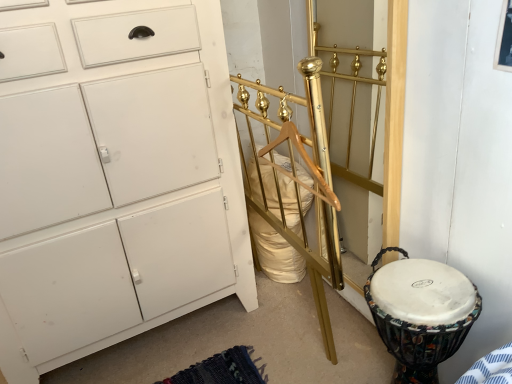
The image size is (512, 384). What are the coordinates of `white fabric-covered drum at lower right` in the screenshot? It's located at (421, 313).

What do you see at coordinates (298, 181) in the screenshot?
I see `gold polished metal bed frame at center` at bounding box center [298, 181].

Where is `white fabric-covered drum at lower right`? The width and height of the screenshot is (512, 384). white fabric-covered drum at lower right is located at coordinates (421, 313).

From their relative heights in the image, would you say white fabric-covered drum at lower right is taller or shorter than white matte cabinet at left?

white fabric-covered drum at lower right is shorter than white matte cabinet at left.

From a real-world perspective, is white fabric-covered drum at lower right under white matte cabinet at left?

Yes, from a real-world perspective, white fabric-covered drum at lower right is beneath white matte cabinet at left.

Which of these two, white matte cabinet at left or gold polished metal bed frame at center, stands taller?

Standing taller between the two is white matte cabinet at left.

Considering the points (229, 169) and (279, 178), which point is in front, point (229, 169) or point (279, 178)?

Positioned in front is point (229, 169).

How distant is white matte cabinet at left from gold polished metal bed frame at center?

A distance of 39.98 centimeters exists between white matte cabinet at left and gold polished metal bed frame at center.

From the image's perspective, between gold polished metal bed frame at center and white matte cabinet at left, who is located below?

gold polished metal bed frame at center appears lower in the image.

This screenshot has width=512, height=384. I want to click on bed frame to the right of white matte cabinet at left, so click(x=298, y=181).

Is the surface of gold polished metal bed frame at center in direct contact with white matte cabinet at left?

There is a gap between gold polished metal bed frame at center and white matte cabinet at left.

Can you confirm if white matte cabinet at left is wider than white fabric-covered drum at lower right?

Yes, white matte cabinet at left is wider than white fabric-covered drum at lower right.

Is white matte cabinet at left facing towards white fabric-covered drum at lower right?

Yes, white matte cabinet at left is facing white fabric-covered drum at lower right.

Which object is positioned more to the left, white matte cabinet at left or white fabric-covered drum at lower right?

Positioned to the left is white matte cabinet at left.

Which is behind, point (206, 74) or point (447, 355)?

Point (206, 74)

Looking at this image, how distant is gold polished metal bed frame at center from white fabric-covered drum at lower right?

They are 12.82 inches apart.

Which object is positioned more to the right, gold polished metal bed frame at center or white fabric-covered drum at lower right?

From the viewer's perspective, white fabric-covered drum at lower right appears more on the right side.

Are gold polished metal bed frame at center and white fabric-covered drum at lower right far apart?

No.

How many degrees apart are the facing directions of gold polished metal bed frame at center and white fabric-covered drum at lower right?

They differ by 0.828 degrees in their facing directions.

Is white fabric-covered drum at lower right thinner than gold polished metal bed frame at center?

In fact, white fabric-covered drum at lower right might be wider than gold polished metal bed frame at center.

From the image's perspective, which is below, white fabric-covered drum at lower right or gold polished metal bed frame at center?

From the image's view, white fabric-covered drum at lower right is below.

From the picture: Considering the positions of objects white fabric-covered drum at lower right and gold polished metal bed frame at center in the image provided, who is more to the left, white fabric-covered drum at lower right or gold polished metal bed frame at center?

gold polished metal bed frame at center.

The height and width of the screenshot is (384, 512). Find the location of `the chest of drawers positioned vertically above the white fabric-covered drum at lower right (from a real-world perspective)`. the chest of drawers positioned vertically above the white fabric-covered drum at lower right (from a real-world perspective) is located at coordinates (113, 176).

The height and width of the screenshot is (384, 512). Identify the location of bed frame directly beneath the white matte cabinet at left (from a real-world perspective). pos(298,181).

Looking at the image, which one is located closer to white matte cabinet at left, gold polished metal bed frame at center or white fabric-covered drum at lower right?

The object closer to white matte cabinet at left is gold polished metal bed frame at center.

From the image, which object appears to be farther from gold polished metal bed frame at center, white fabric-covered drum at lower right or white matte cabinet at left?

Among the two, white matte cabinet at left is located further to gold polished metal bed frame at center.

From the image, which object appears to be farther from white matte cabinet at left, white fabric-covered drum at lower right or gold polished metal bed frame at center?

Based on the image, white fabric-covered drum at lower right appears to be further to white matte cabinet at left.

Looking at the image, which one is located further to white fabric-covered drum at lower right, gold polished metal bed frame at center or white matte cabinet at left?

white matte cabinet at left.

Considering their positions, is white matte cabinet at left positioned closer to gold polished metal bed frame at center than white fabric-covered drum at lower right?

white fabric-covered drum at lower right lies closer to gold polished metal bed frame at center than the other object.

When comparing their distances from white fabric-covered drum at lower right, does white matte cabinet at left or gold polished metal bed frame at center seem closer?

gold polished metal bed frame at center.

Where is `bed frame between white matte cabinet at left and white fabric-covered drum at lower right`? bed frame between white matte cabinet at left and white fabric-covered drum at lower right is located at coordinates (298, 181).